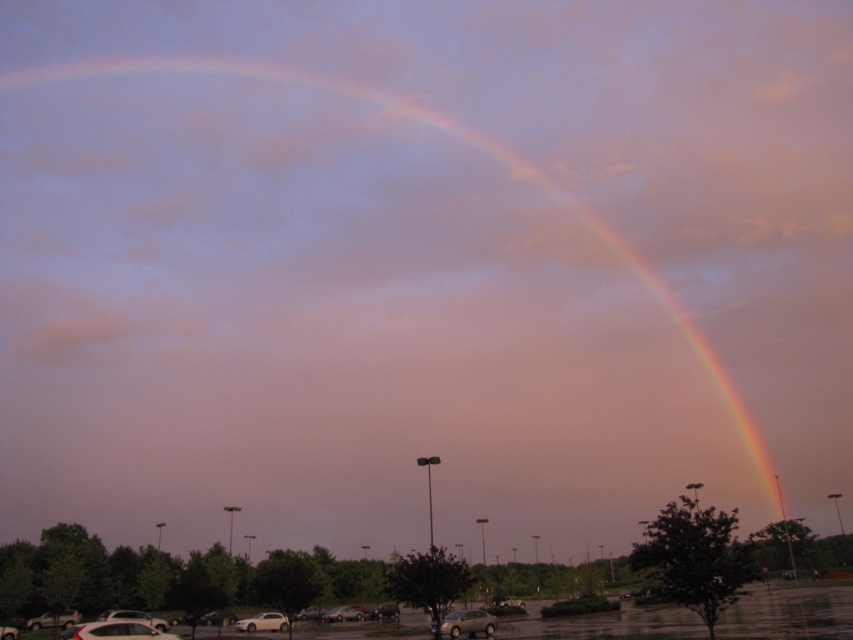
Does rainbow at upper center have a larger size compared to silver metallic sedan at center?

Correct, rainbow at upper center is larger in size than silver metallic sedan at center.

Which of these two, rainbow at upper center or silver metallic sedan at center, stands shorter?

Standing shorter between the two is silver metallic sedan at center.

Locate an element on the screen. The image size is (853, 640). rainbow at upper center is located at coordinates (326, 321).

Find the location of a particular element. satin silver sedan at lower center is located at coordinates (467, 624).

Where is `satin silver sedan at lower center`? The width and height of the screenshot is (853, 640). satin silver sedan at lower center is located at coordinates (467, 624).

Can you confirm if metallic gray cars at lower center is positioned to the right of white matte car at lower left?

Correct, you'll find metallic gray cars at lower center to the right of white matte car at lower left.

Does point (659, 605) lie behind point (123, 612)?

That is True.

Describe the element at coordinates (788, 612) in the screenshot. I see `metallic gray cars at lower center` at that location.

This screenshot has height=640, width=853. Find the location of `metallic gray cars at lower center`. metallic gray cars at lower center is located at coordinates (788, 612).